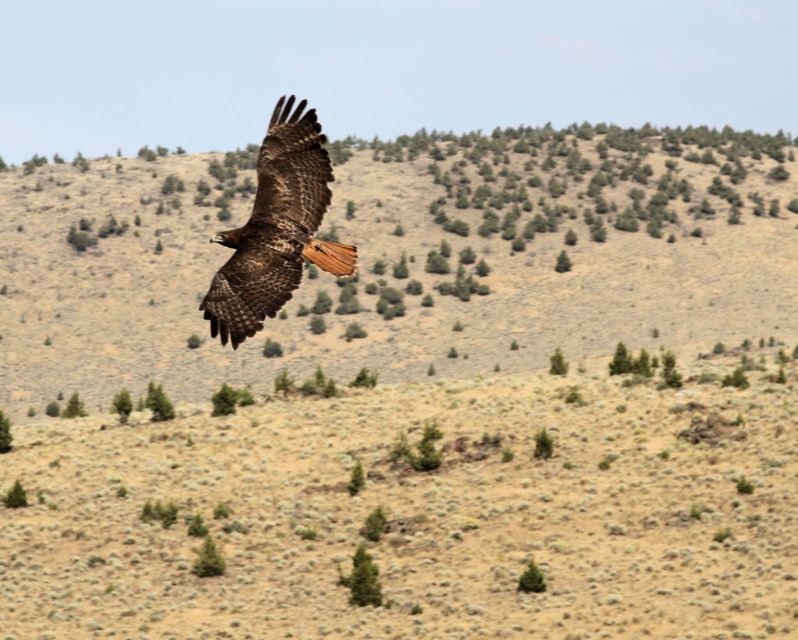
Question: Among these objects, which one is farthest from the camera?

Choices:
 (A) brown feathered eagle at center
 (B) green leafy tree at lower left
 (C) green textured tree at lower center

Answer: (B)

Question: Is green textured tree at lower center in front of green leafy tree at lower left?

Choices:
 (A) no
 (B) yes

Answer: (B)

Question: Is brown feathered eagle at center wider than green textured tree at lower center?

Choices:
 (A) yes
 (B) no

Answer: (A)

Question: Based on their relative distances, which object is farther from the green leafy tree at lower left?

Choices:
 (A) brown feathered eagle at center
 (B) green textured tree at lower center

Answer: (A)

Question: Which object appears farthest from the camera in this image?

Choices:
 (A) green leafy tree at lower left
 (B) green textured tree at lower center
 (C) brown feathered eagle at center

Answer: (A)

Question: Is the position of brown feathered eagle at center less distant than that of green leafy tree at lower left?

Choices:
 (A) yes
 (B) no

Answer: (A)